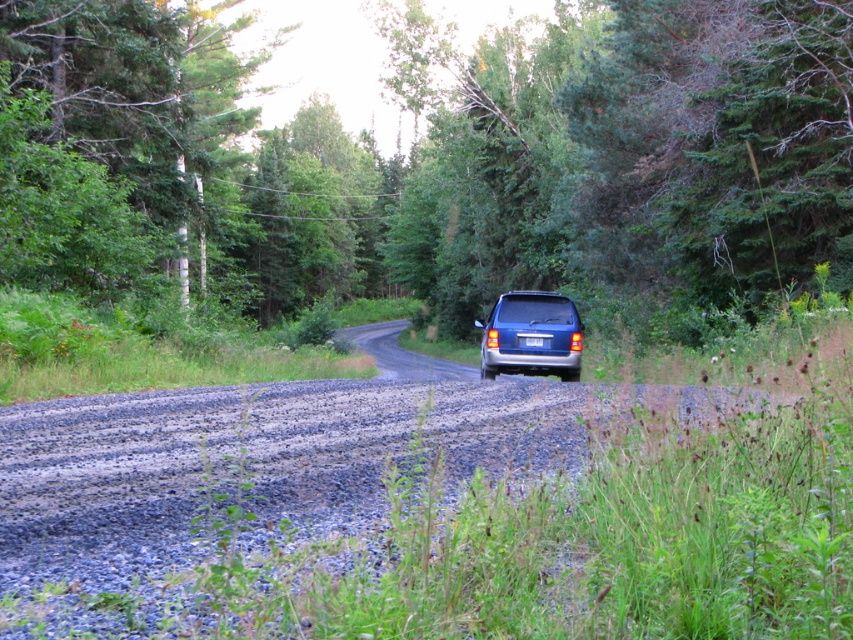
You are standing at the point with coordinates (531,336) in the rural forest scene. What object is exactly at your location?

The satin blue suv at center is located at point (531,336), so the object at your location is the satin blue suv at center.

You are a delivery driver who needs to park your truck next to the satin blue suv at center and the blue metallic license plate at center. Which object should you avoid parking too close to because of its height?

You should avoid parking too close to the satin blue suv at center because it has a greater height compared to the blue metallic license plate at center.

You are standing at the point with coordinates 0.5, 0.5 in the image. You want to walk to the gray gravel road at center. In which direction should you move?

You should move towards the direction of point (242, 456) to reach the gray gravel road at center.